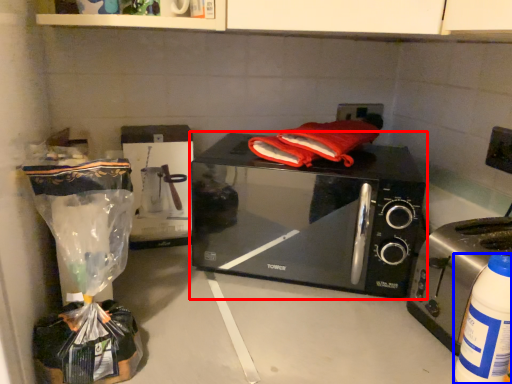
Question: Which point is closer to the camera, microwave oven (highlighted by a red box) or bottle (highlighted by a blue box)?

Choices:
 (A) microwave oven
 (B) bottle

Answer: (B)